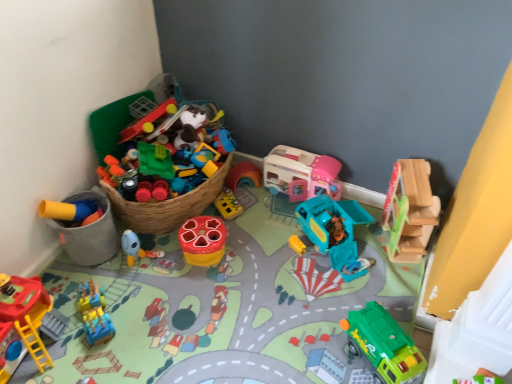
I want to click on vacant space that is in between rubberized plastic toy at center, positioned as the fourth toy in left-to-right order, and blue plastic train at lower left, placed as the second toy when sorted from left to right, so click(x=153, y=285).